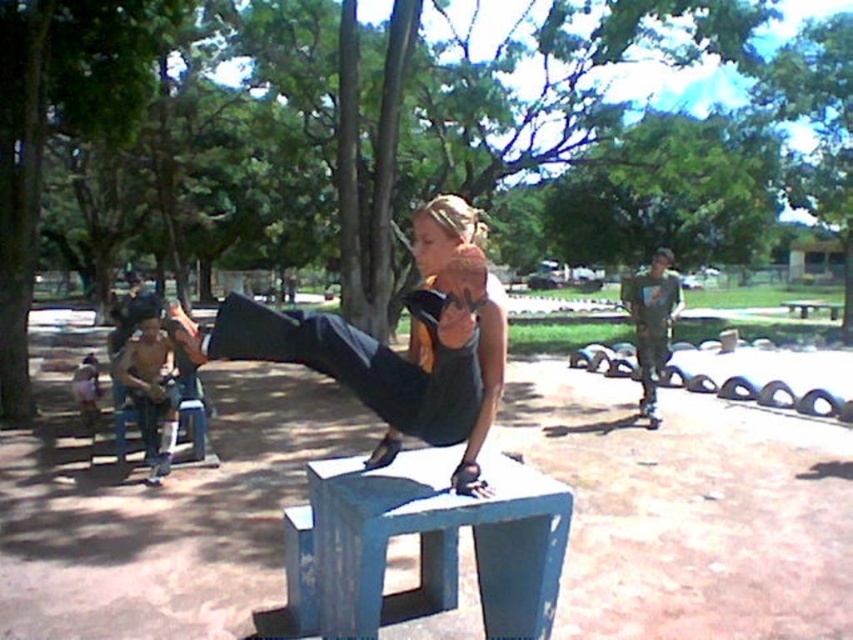
Question: Does blue painted concrete bench at center have a greater width compared to wooden park bench at center?

Choices:
 (A) yes
 (B) no

Answer: (B)

Question: Does blue painted concrete bench at center lie behind shiny metallic helmet at left?

Choices:
 (A) yes
 (B) no

Answer: (B)

Question: Estimate the real-world distances between objects in this image. Which object is closer to the shiny metallic helmet at left?

Choices:
 (A) camouflage-patterned shirt at right
 (B) matte black pants at center
 (C) wooden park bench at center

Answer: (B)

Question: Estimate the real-world distances between objects in this image. Which object is farther from the matte black pants at center?

Choices:
 (A) shiny metallic helmet at left
 (B) camouflage-patterned shirt at right
 (C) wooden park bench at center

Answer: (C)

Question: Is matte black pants at center bigger than wooden park bench at center?

Choices:
 (A) yes
 (B) no

Answer: (B)

Question: Which point appears closest to the camera in this image?

Choices:
 (A) (387, 436)
 (B) (651, 257)
 (C) (137, 305)

Answer: (A)